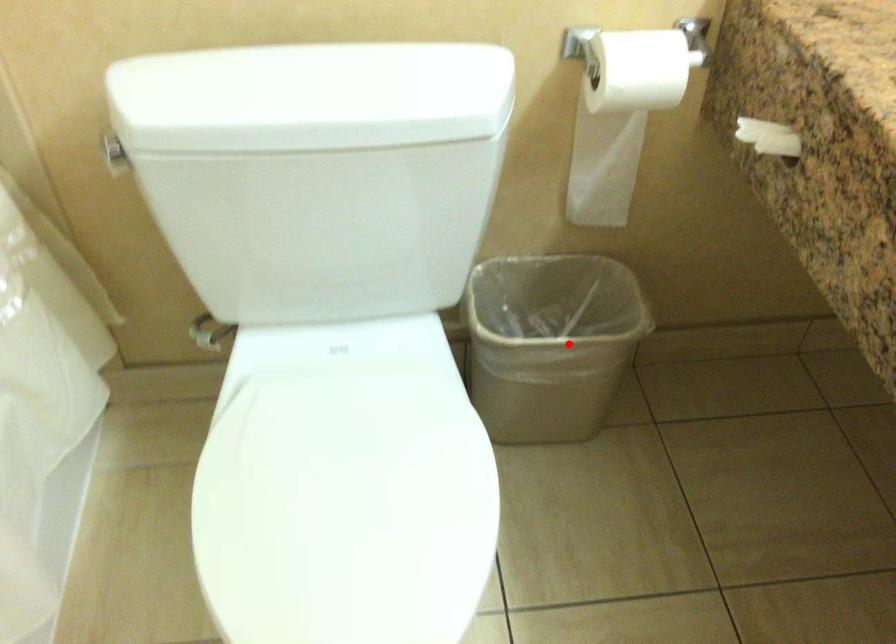
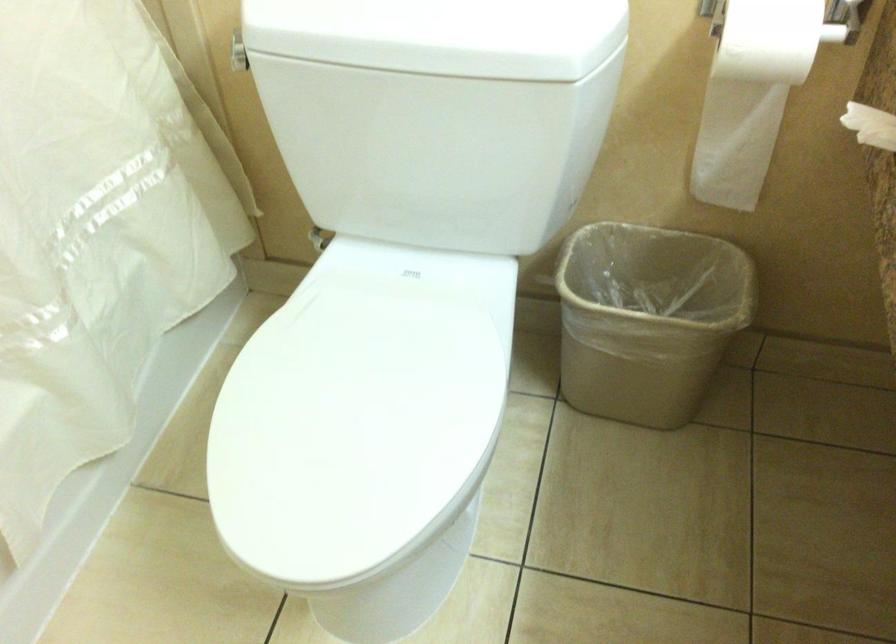
Where in the second image is the point corresponding to the highlighted location from the first image?

(647, 319)